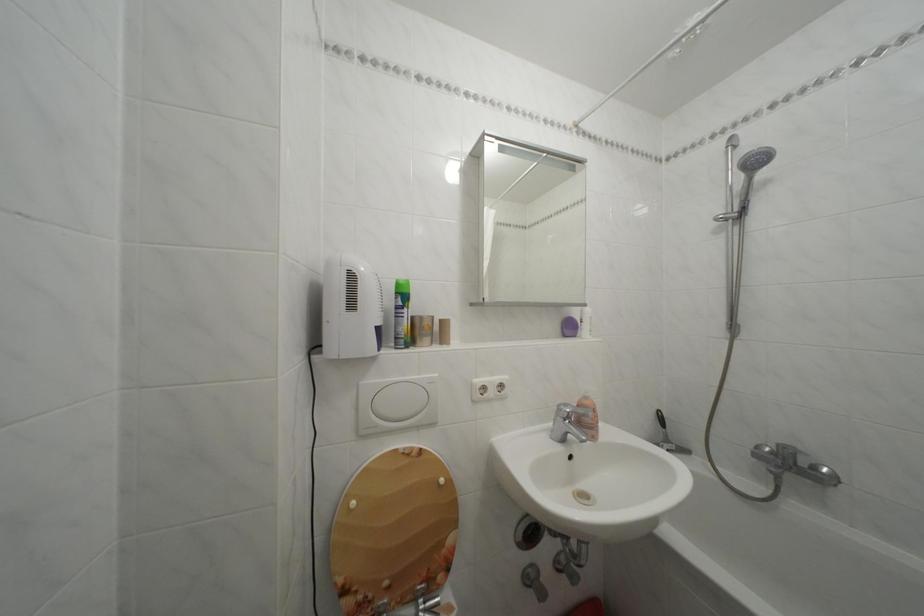
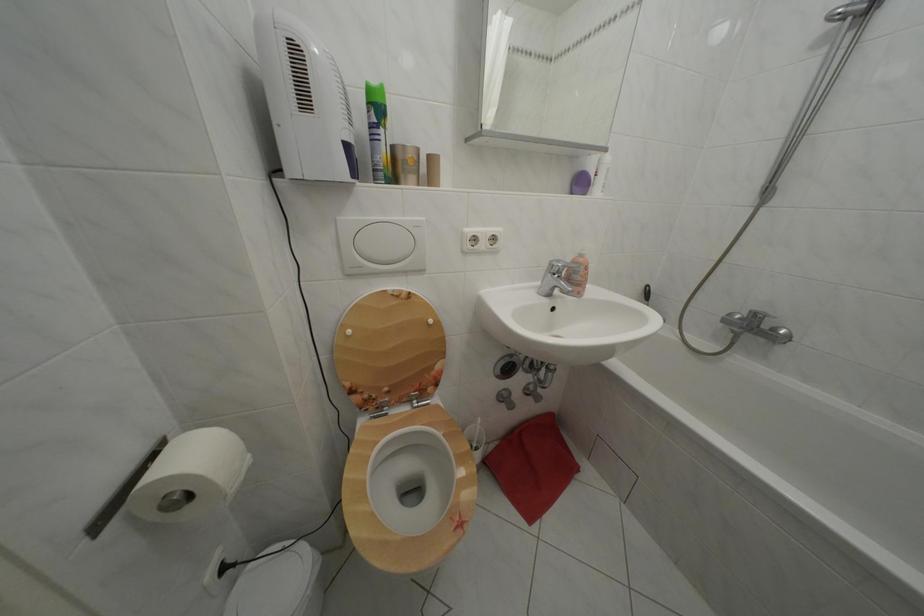
Where in the second image is the point corresponding to (x=406, y=300) from the first image?

(378, 110)